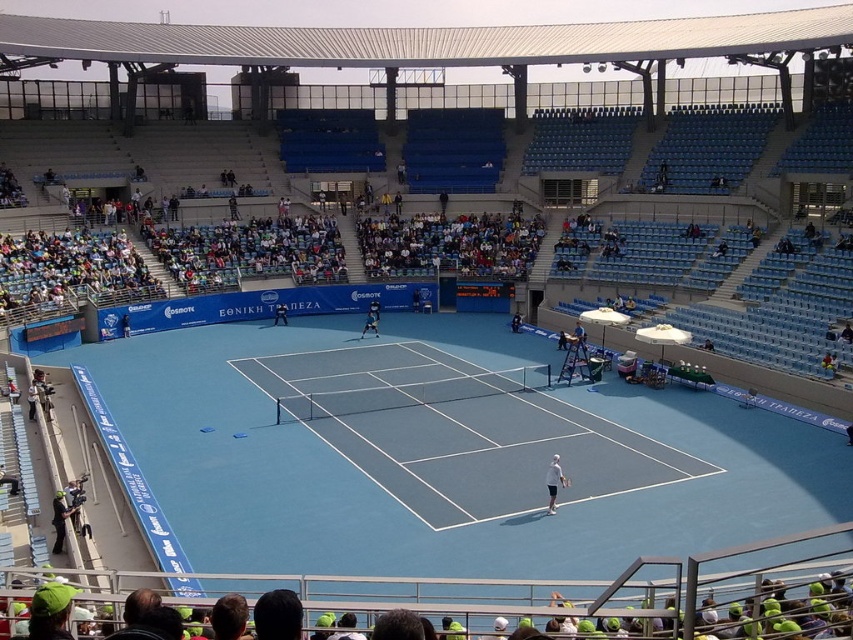
Question: In this image, where is blue clay tennis court at center located relative to white fabric umbrella at center?

Choices:
 (A) right
 (B) left

Answer: (B)

Question: Is dark gray suit at lower left to the right of white fabric tennis racket at center from the viewer's perspective?

Choices:
 (A) yes
 (B) no

Answer: (B)

Question: Which point appears farthest from the camera in this image?

Choices:
 (A) (508, 390)
 (B) (671, 477)
 (C) (374, 330)
 (D) (64, 531)

Answer: (C)

Question: Which of these objects is positioned farthest from the white fabric tennis racket at center?

Choices:
 (A) dark blue tennis outfit at center
 (B) blue synthetic surface at center
 (C) white tennis racket at center
 (D) blue clay tennis court at center

Answer: (A)

Question: Which object is positioned closest to the dark blue uniform at center?

Choices:
 (A) blue synthetic surface at center
 (B) white tennis racket at center
 (C) white fabric umbrella at center
 (D) blue clay tennis court at center

Answer: (B)

Question: Is blue synthetic surface at center smaller than white tennis racket at center?

Choices:
 (A) yes
 (B) no

Answer: (B)